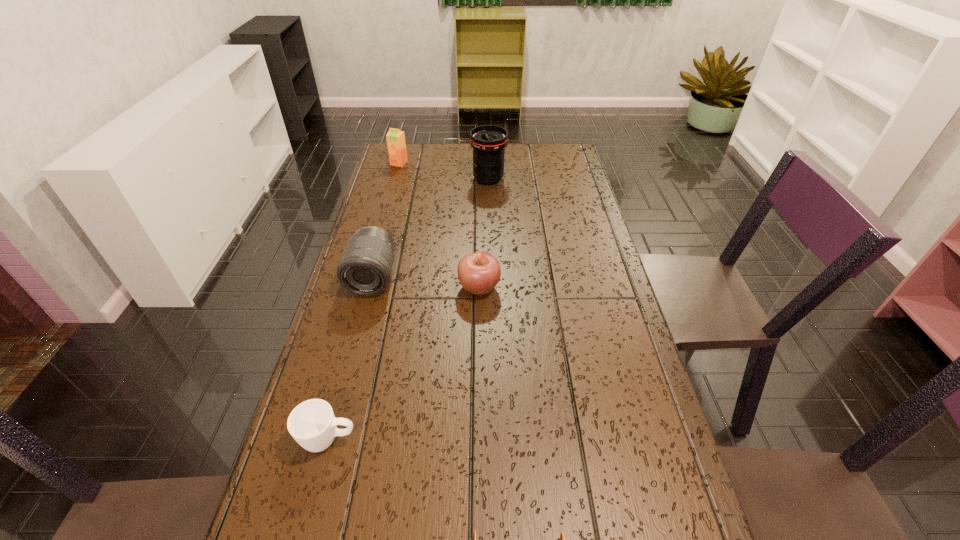
What are the coordinates of `the farther telephoto lens` in the screenshot? It's located at (488, 141).

This screenshot has height=540, width=960. Find the location of `the tallest object`. the tallest object is located at coordinates (488, 141).

Find the location of a particular element. This screenshot has width=960, height=540. orange juice is located at coordinates (396, 144).

Where is `the nearer telephoto lens`? the nearer telephoto lens is located at coordinates (365, 268).

This screenshot has height=540, width=960. I want to click on the shorter telephoto lens, so click(x=365, y=268).

You are a GUI agent. You are given a task and a screenshot of the screen. Output one action in this format:
    pyautogui.click(x=<x>, y=<y>)
    Task: Click on the apple
    The width and height of the screenshot is (960, 540).
    Given the screenshot: What is the action you would take?
    point(479,272)

In order to click on cup in this screenshot , I will do `click(312, 424)`.

Identify the location of the fifth tallest object. This screenshot has width=960, height=540. (312, 424).

Locate an element on the screen. The width and height of the screenshot is (960, 540). vacant area situated on the left of the taller telephoto lens is located at coordinates (395, 179).

This screenshot has width=960, height=540. I want to click on vacant area situated 0.090m on the front of the orange juice, so click(x=395, y=180).